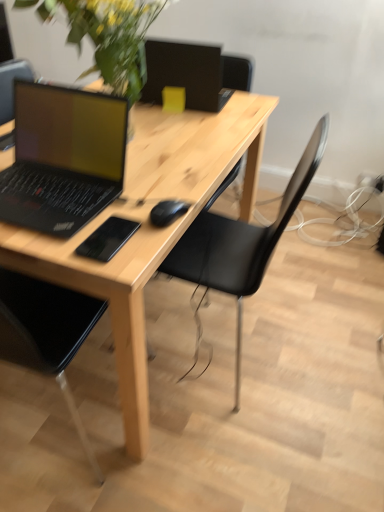
Where is `free spot to the right of matte black laptop at left`? free spot to the right of matte black laptop at left is located at coordinates (165, 188).